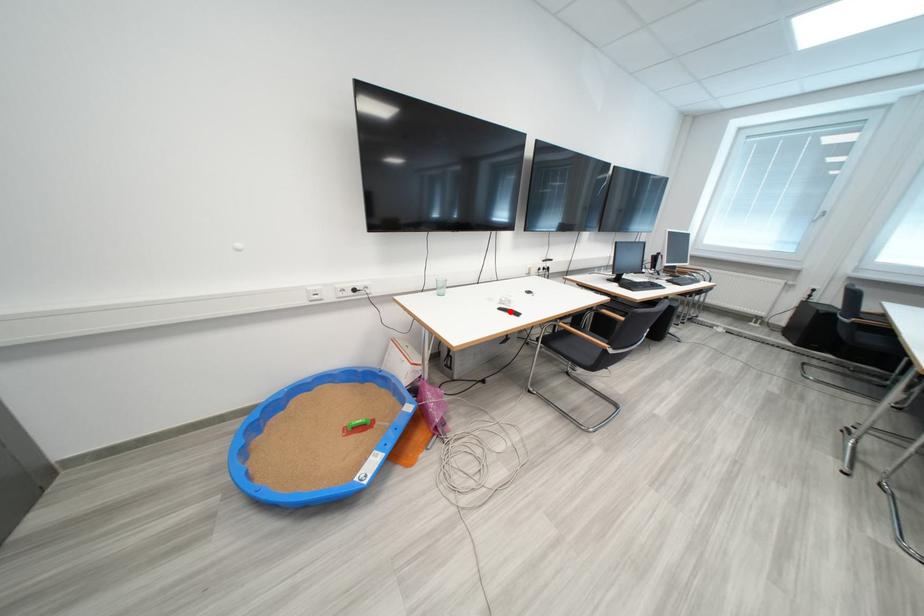
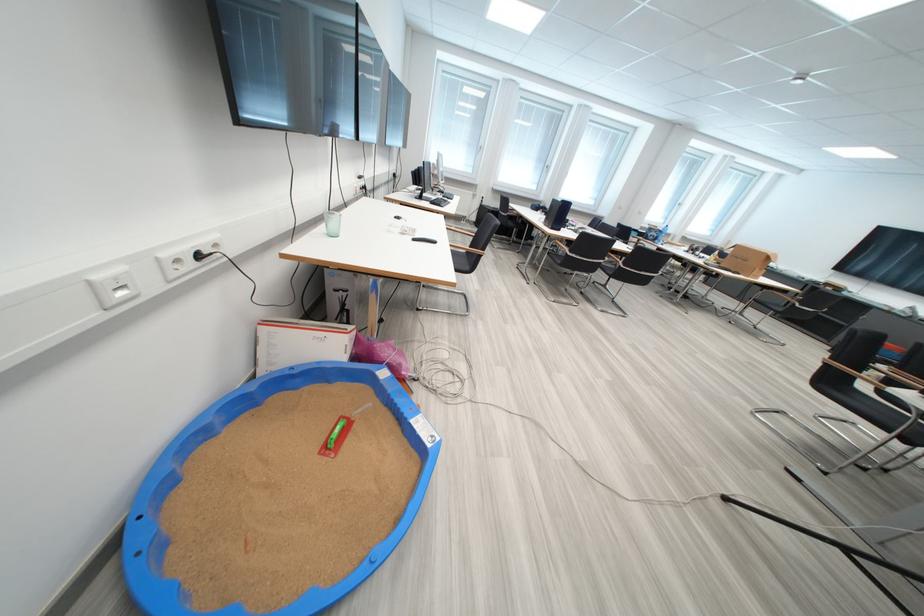
Locate, in the second image, the point that corresponds to the highlighted location in the first image.

(424, 241)